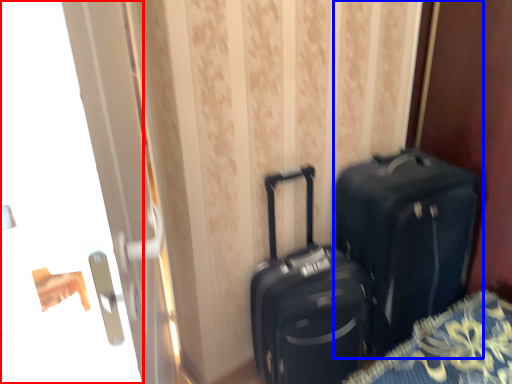
Question: Among these objects, which one is farthest to the camera, screen door (highlighted by a red box) or luggage and bags (highlighted by a blue box)?

Choices:
 (A) screen door
 (B) luggage and bags

Answer: (B)